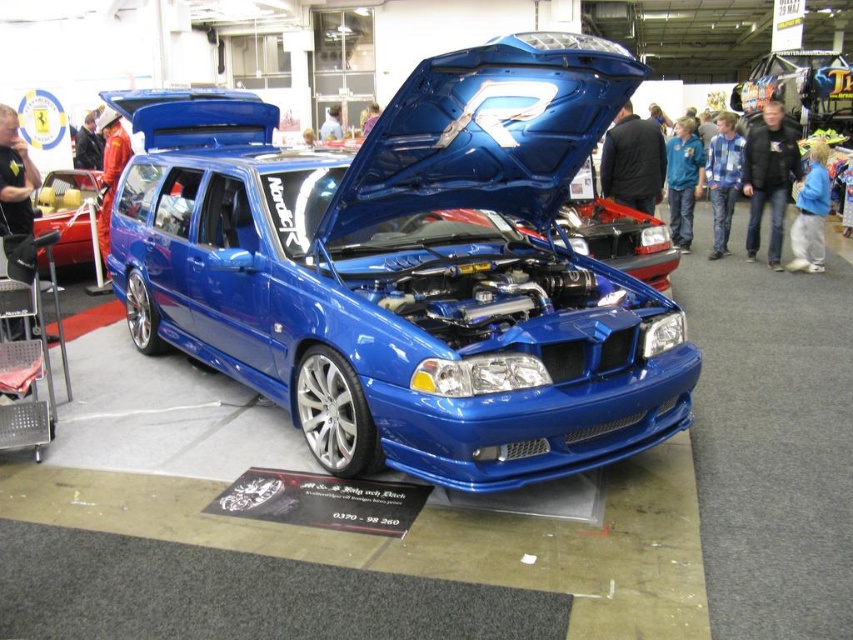
You are standing in the car show and see the shiny blue car at center and the metallic yellow car at left. Which car is positioned lower in the image?

The shiny blue car at center is located below the metallic yellow car at left, so it is positioned lower in the image.

You are standing in front of two cars at a car exhibition. The shiny blue car at center and the metallic yellow car at left. Which car is nearer to you?

The shiny blue car at center is closer to the viewer than the metallic yellow car at left, so the shiny blue car at center is nearer to you.